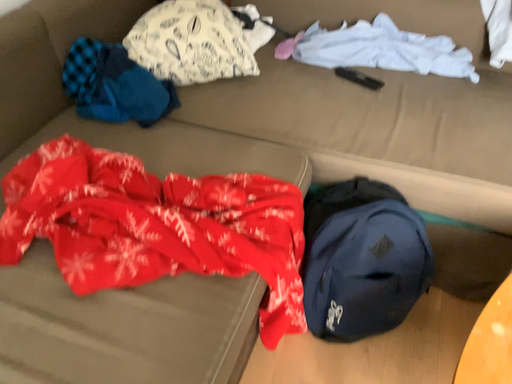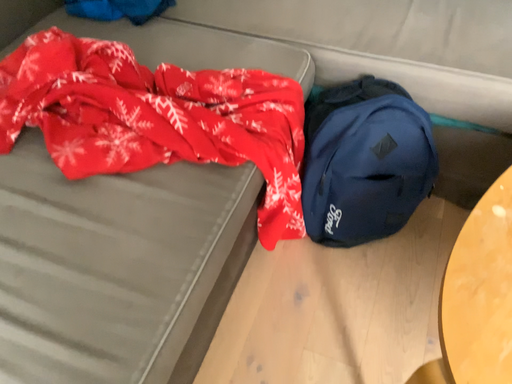
Question: How did the camera likely rotate when shooting the video?

Choices:
 (A) rotated upward
 (B) rotated downward

Answer: (B)